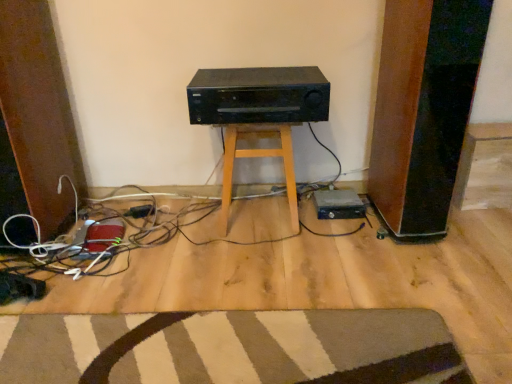
This screenshot has width=512, height=384. Identify the location of vacant space in between wooden stool at center and striped carpet at lower center. (233, 272).